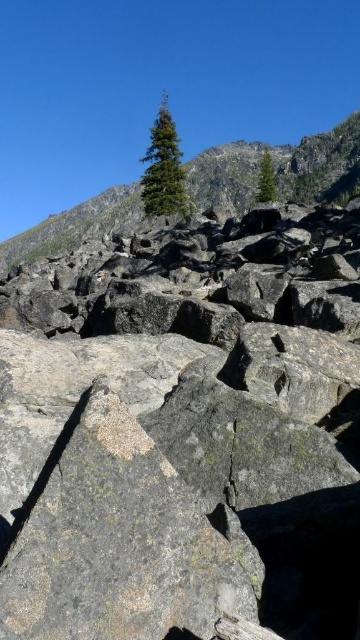
Question: Is gray granite rock at center below green coniferous tree at upper center?

Choices:
 (A) yes
 (B) no

Answer: (A)

Question: Observing the image, what is the correct spatial positioning of gray granite rock at center in reference to green coniferous tree at upper center?

Choices:
 (A) left
 (B) right

Answer: (A)

Question: Does gray granite rock at center appear on the left side of green coniferous tree at upper center?

Choices:
 (A) no
 (B) yes

Answer: (B)